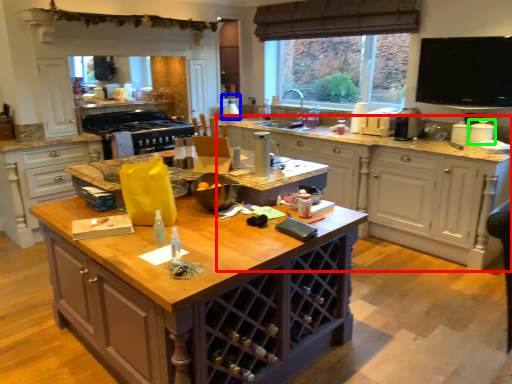
Question: Which object is the closest to the cabinetry (highlighted by a red box)? Choose among these: appliance (highlighted by a blue box) or appliance (highlighted by a green box).

Choices:
 (A) appliance
 (B) appliance

Answer: (B)